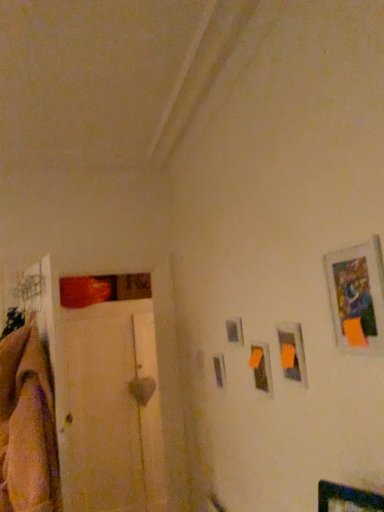
Measure the distance between metallic silver picture frame at center-right, the 1th picture frame viewed from the left, and camera.

1.85 meters.

Measure the distance between point (242,336) and camera.

6.09 feet.

The image size is (384, 512). Describe the element at coordinates (357, 295) in the screenshot. I see `metallic silver picture frame at upper right, which is the fourth picture frame from back to front` at that location.

Describe the element at coordinates (107, 395) in the screenshot. I see `white wood door at left` at that location.

Image resolution: width=384 pixels, height=512 pixels. Identify the location of matte plastic picture frame at upper right, the second picture frame from the front. (292, 353).

Which of these two, metallic silver picture frame at center-right, marked as the 4th picture frame in a front-to-back arrangement, or matte plastic picture frame at center, which is counted as the 3th picture frame, starting from the right, is wider?

matte plastic picture frame at center, which is counted as the 3th picture frame, starting from the right.

From the image's perspective, is metallic silver picture frame at center-right, marked as the 4th picture frame in a front-to-back arrangement, above matte plastic picture frame at center, which is the third picture frame from front to back?

Yes, from the image's perspective, metallic silver picture frame at center-right, marked as the 4th picture frame in a front-to-back arrangement, is above matte plastic picture frame at center, which is the third picture frame from front to back.

Does point (234, 321) come farther from viewer compared to point (267, 392)?

Yes, point (234, 321) is farther from viewer.

Is soft beige blanket at left inside the boundaries of white wood door at left, or outside?

soft beige blanket at left is not enclosed by white wood door at left.

From their relative heights in the image, would you say soft beige blanket at left is taller or shorter than white wood door at left?

In the image, soft beige blanket at left appears to be shorter than white wood door at left.

In the image, is soft beige blanket at left positioned in front of or behind white wood door at left?

soft beige blanket at left is in front of white wood door at left.

Is soft beige blanket at left thinner than white wood door at left?

Incorrect, the width of soft beige blanket at left is not less than that of white wood door at left.

Is soft beige blanket at left far away from metallic silver picture frame at center-right, the 1th picture frame viewed from the back?

No, soft beige blanket at left is in close proximity to metallic silver picture frame at center-right, the 1th picture frame viewed from the back.

At what (x,y) coordinates should I click in order to perform the action: click on blanket lying in front of the metallic silver picture frame at center-right, the 1th picture frame viewed from the back. Please return your answer as a coordinate pair (x, y). Image resolution: width=384 pixels, height=512 pixels. Looking at the image, I should click on (27, 426).

From a real-world perspective, between soft beige blanket at left and metallic silver picture frame at center-right, the 1th picture frame viewed from the back, who is vertically lower?

soft beige blanket at left, from a real-world perspective.

From the image's perspective, which object appears higher, soft beige blanket at left or metallic silver picture frame at center-right, marked as the 4th picture frame in a front-to-back arrangement?

metallic silver picture frame at center-right, marked as the 4th picture frame in a front-to-back arrangement, from the image's perspective.

In the scene shown: Which of these two, soft beige blanket at left or matte plastic picture frame at upper right, acting as the 3th picture frame starting from the left, stands shorter?

Standing shorter between the two is matte plastic picture frame at upper right, acting as the 3th picture frame starting from the left.

Is soft beige blanket at left aimed at matte plastic picture frame at upper right, which is counted as the second picture frame, starting from the right?

No, soft beige blanket at left is not turned towards matte plastic picture frame at upper right, which is counted as the second picture frame, starting from the right.

Which object is positioned more to the left, soft beige blanket at left or matte plastic picture frame at upper right, the second picture frame from the front?

soft beige blanket at left.

Is matte plastic picture frame at center, which is the 2th picture frame from left to right, wider than metallic silver picture frame at center-right, marked as the 4th picture frame in a front-to-back arrangement?

Yes.

From the image's perspective, which one is positioned lower, matte plastic picture frame at center, which is counted as the 2th picture frame, starting from the back, or metallic silver picture frame at center-right, marked as the 4th picture frame in a front-to-back arrangement?

From the image's view, matte plastic picture frame at center, which is counted as the 2th picture frame, starting from the back, is below.

Does matte plastic picture frame at center, which is counted as the 3th picture frame, starting from the right, have a lesser height compared to metallic silver picture frame at center-right, the 1th picture frame viewed from the back?

Incorrect, the height of matte plastic picture frame at center, which is counted as the 3th picture frame, starting from the right, does not fall short of that of metallic silver picture frame at center-right, the 1th picture frame viewed from the back.

How far apart are matte plastic picture frame at center, which is the third picture frame from front to back, and metallic silver picture frame at center-right, marked as the 4th picture frame in a front-to-back arrangement?

matte plastic picture frame at center, which is the third picture frame from front to back, and metallic silver picture frame at center-right, marked as the 4th picture frame in a front-to-back arrangement, are 8.73 inches apart.

Where is `the 1st picture frame positioned below the metallic silver picture frame at upper right, acting as the first picture frame starting from the front (from the image's perspective)`? the 1st picture frame positioned below the metallic silver picture frame at upper right, acting as the first picture frame starting from the front (from the image's perspective) is located at coordinates (292, 353).

Considering the relative positions of metallic silver picture frame at upper right, which is the 4th picture frame from left to right, and matte plastic picture frame at upper right, which is counted as the second picture frame, starting from the right, in the image provided, is metallic silver picture frame at upper right, which is the 4th picture frame from left to right, in front of matte plastic picture frame at upper right, which is counted as the second picture frame, starting from the right,?

Yes, it is in front of matte plastic picture frame at upper right, which is counted as the second picture frame, starting from the right.

From the image's perspective, which is above, metallic silver picture frame at upper right, the 1th picture frame viewed from the right, or matte plastic picture frame at upper right, placed as the third picture frame when sorted from back to front?

From the image's view, metallic silver picture frame at upper right, the 1th picture frame viewed from the right, is above.

Is metallic silver picture frame at upper right, the 1th picture frame viewed from the right, oriented towards matte plastic picture frame at upper right, acting as the 3th picture frame starting from the left?

No, metallic silver picture frame at upper right, the 1th picture frame viewed from the right, is not facing towards matte plastic picture frame at upper right, acting as the 3th picture frame starting from the left.

From a real-world perspective, relative to metallic silver picture frame at upper right, which is the fourth picture frame from back to front, is matte plastic picture frame at upper right, the second picture frame from the front, vertically above or below?

Clearly, from a real-world perspective, matte plastic picture frame at upper right, the second picture frame from the front, is below metallic silver picture frame at upper right, which is the fourth picture frame from back to front.

Between matte plastic picture frame at upper right, placed as the third picture frame when sorted from back to front, and metallic silver picture frame at upper right, the 1th picture frame viewed from the right, which one appears on the left side from the viewer's perspective?

matte plastic picture frame at upper right, placed as the third picture frame when sorted from back to front, is more to the left.

Is matte plastic picture frame at upper right, placed as the third picture frame when sorted from back to front, wider than metallic silver picture frame at upper right, which is the fourth picture frame from back to front?

Correct, the width of matte plastic picture frame at upper right, placed as the third picture frame when sorted from back to front, exceeds that of metallic silver picture frame at upper right, which is the fourth picture frame from back to front.

From the image's perspective, relative to metallic silver picture frame at upper right, which is the fourth picture frame from back to front, is matte plastic picture frame at upper right, which is counted as the second picture frame, starting from the right, above or below?

Based on their image positions, matte plastic picture frame at upper right, which is counted as the second picture frame, starting from the right, is located beneath metallic silver picture frame at upper right, which is the fourth picture frame from back to front.

Locate an element on the screen. The width and height of the screenshot is (384, 512). the 2nd picture frame below the metallic silver picture frame at center-right, the 1th picture frame viewed from the back (from a real-world perspective) is located at coordinates (260, 367).

Locate an element on the screen. This screenshot has height=512, width=384. blanket lying above the white wood door at left (from the image's perspective) is located at coordinates (27, 426).

Which object lies nearer to the anchor point matte plastic picture frame at center, which is counted as the 3th picture frame, starting from the right, metallic silver picture frame at center-right, the 1th picture frame viewed from the left, or matte plastic picture frame at upper right, the second picture frame from the front?

The object closer to matte plastic picture frame at center, which is counted as the 3th picture frame, starting from the right, is matte plastic picture frame at upper right, the second picture frame from the front.

In the scene shown: Which object lies nearer to the anchor point white wood door at left, metallic silver picture frame at upper right, which is the fourth picture frame from back to front, or soft beige blanket at left?

Among the two, soft beige blanket at left is located nearer to white wood door at left.

From the image, which object appears to be farther from white wood door at left, matte plastic picture frame at upper right, which is counted as the second picture frame, starting from the right, or matte plastic picture frame at center, which is the 2th picture frame from left to right?

matte plastic picture frame at upper right, which is counted as the second picture frame, starting from the right, lies further to white wood door at left than the other object.

In the scene shown: From the image, which object appears to be nearer to matte plastic picture frame at upper right, placed as the third picture frame when sorted from back to front, white wood door at left or soft beige blanket at left?

soft beige blanket at left is closer to matte plastic picture frame at upper right, placed as the third picture frame when sorted from back to front.

Considering their positions, is white wood door at left positioned closer to soft beige blanket at left than metallic silver picture frame at upper right, acting as the first picture frame starting from the front?

Based on the image, metallic silver picture frame at upper right, acting as the first picture frame starting from the front, appears to be nearer to soft beige blanket at left.

Estimate the real-world distances between objects in this image. Which object is closer to metallic silver picture frame at upper right, which is the fourth picture frame from back to front, white wood door at left or soft beige blanket at left?

soft beige blanket at left is positioned closer to the anchor metallic silver picture frame at upper right, which is the fourth picture frame from back to front.

Looking at the image, which one is located closer to metallic silver picture frame at center-right, positioned as the fourth picture frame in right-to-left order, metallic silver picture frame at upper right, the 1th picture frame viewed from the right, or white wood door at left?

Result: The object closer to metallic silver picture frame at center-right, positioned as the fourth picture frame in right-to-left order, is metallic silver picture frame at upper right, the 1th picture frame viewed from the right.

Estimate the real-world distances between objects in this image. Which object is closer to matte plastic picture frame at upper right, placed as the third picture frame when sorted from back to front, white wood door at left or metallic silver picture frame at upper right, which is the 4th picture frame from left to right?

metallic silver picture frame at upper right, which is the 4th picture frame from left to right, lies closer to matte plastic picture frame at upper right, placed as the third picture frame when sorted from back to front, than the other object.

The width and height of the screenshot is (384, 512). What are the coordinates of `picture frame between metallic silver picture frame at upper right, acting as the first picture frame starting from the front, and matte plastic picture frame at center, which is counted as the 3th picture frame, starting from the right, in the front-back direction` in the screenshot? It's located at (292, 353).

Where is `picture frame situated between soft beige blanket at left and matte plastic picture frame at center, which is the third picture frame from front to back, from left to right`? picture frame situated between soft beige blanket at left and matte plastic picture frame at center, which is the third picture frame from front to back, from left to right is located at coordinates (234, 331).

Locate an element on the screen. This screenshot has width=384, height=512. blanket between metallic silver picture frame at upper right, which is the 4th picture frame from left to right, and white wood door at left in the front-back direction is located at coordinates (27, 426).

Identify the location of picture frame situated between white wood door at left and matte plastic picture frame at center, which is counted as the 3th picture frame, starting from the right, from left to right. This screenshot has height=512, width=384. (234, 331).